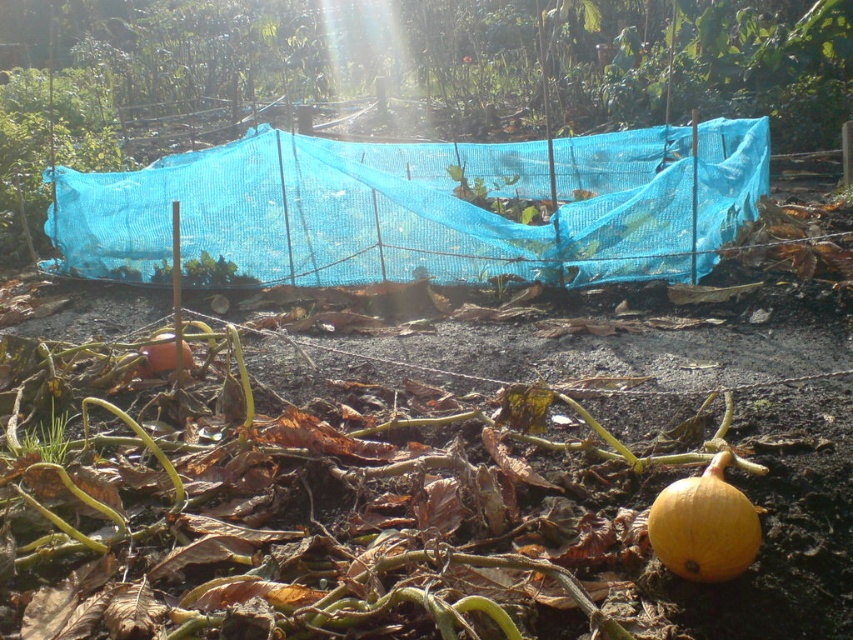
Is point (663, 164) positioned in front of point (154, 339)?

That is False.

Is blue mesh net at center to the left of orange matte pumpkin at lower left from the viewer's perspective?

In fact, blue mesh net at center is to the right of orange matte pumpkin at lower left.

At what (x,y) coordinates should I click in order to perform the action: click on blue mesh net at center. Please return your answer as a coordinate pair (x, y). This screenshot has height=640, width=853. Looking at the image, I should click on (416, 209).

At what (x,y) coordinates should I click in order to perform the action: click on blue mesh net at center. Please return your answer as a coordinate pair (x, y). This screenshot has width=853, height=640. Looking at the image, I should click on (416, 209).

Between point (693, 512) and point (154, 355), which one is positioned in front?

Point (693, 512) is in front.

Does orange matte pumpkin at lower right have a smaller size compared to orange matte pumpkin at lower left?

Indeed, orange matte pumpkin at lower right has a smaller size compared to orange matte pumpkin at lower left.

Describe the element at coordinates (704, 525) in the screenshot. This screenshot has height=640, width=853. I see `orange matte pumpkin at lower right` at that location.

Where is `orange matte pumpkin at lower right`? orange matte pumpkin at lower right is located at coordinates (704, 525).

Does blue mesh net at center come in front of orange matte pumpkin at lower right?

No.

Does blue mesh net at center appear over orange matte pumpkin at lower right?

Correct, blue mesh net at center is located above orange matte pumpkin at lower right.

The height and width of the screenshot is (640, 853). I want to click on blue mesh net at center, so click(x=416, y=209).

Where is `blue mesh net at center`? This screenshot has height=640, width=853. blue mesh net at center is located at coordinates (416, 209).